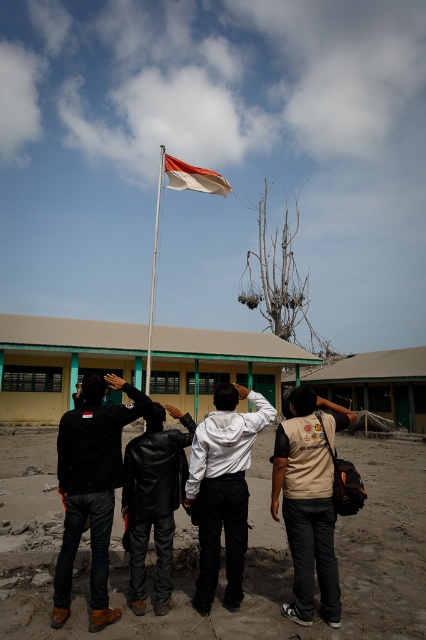
You are a photographer positioned behind the group of people. You want to capture a clear photo of the beige fabric shirt at center without the black leather jacket at left blocking it. What should you do?

The beige fabric shirt at center is behind the black leather jacket at left, so you should move to the side to get an unobstructed view of the beige fabric shirt at center.

You are standing at the origin point in the scene and want to move towards the white matte jacket at center. Based on its coordinates, in which direction should you move?

The white matte jacket at center is located at point 0.764 on the x and 0.523 on the y. Since the origin is at the bottom left corner, you should move to the right and slightly upwards to reach it.